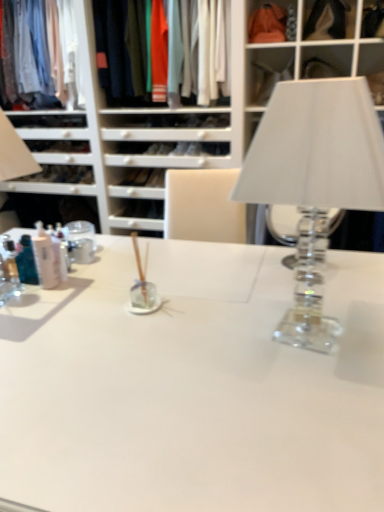
Question: Is clear glass table lamp at right to the left or to the right of matte cotton shirt at upper left, placed as the second clothing when sorted from right to left, in the image?

Choices:
 (A) right
 (B) left

Answer: (A)

Question: From a real-world perspective, is clear glass table lamp at right positioned above or below matte cotton shirt at upper left, which is the 1th clothing from left to right?

Choices:
 (A) below
 (B) above

Answer: (A)

Question: Based on their relative distances, which object is farther from the matte cotton shirt at upper left, which is the 1th clothing from left to right?

Choices:
 (A) matte cotton shirts at upper center, the 1th clothing from the right
 (B) translucent plastic bottles at left
 (C) matte orange fabric at upper center
 (D) clear glass table lamp at right

Answer: (D)

Question: Based on their relative distances, which object is nearer to the matte orange fabric at upper center?

Choices:
 (A) matte cotton shirt at upper left, placed as the second clothing when sorted from right to left
 (B) matte cotton shirts at upper center, the 1th clothing from the right
 (C) translucent plastic bottles at left
 (D) clear glass table lamp at right

Answer: (B)